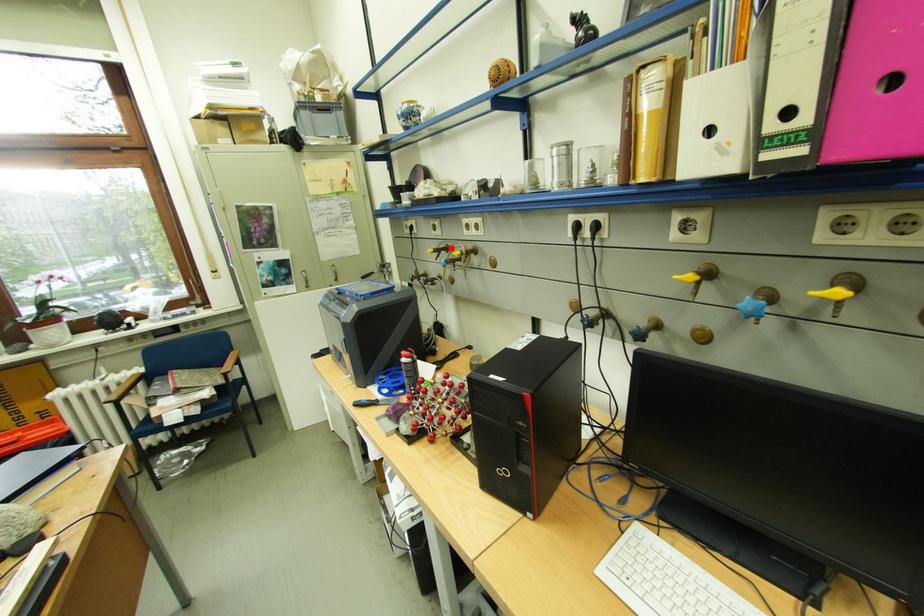
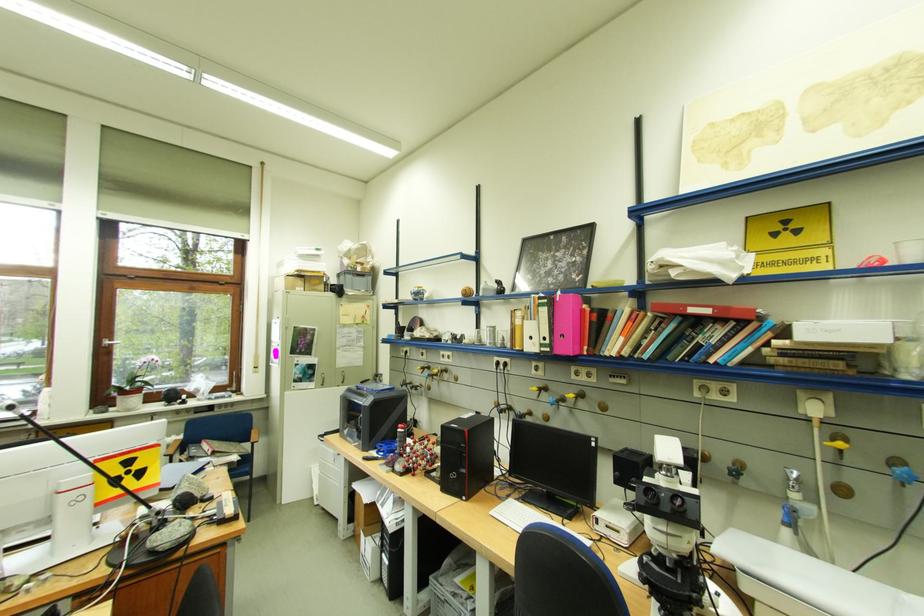
The point at the highlighted location is marked in the first image. Where is the corresponding point in the second image?

(435, 367)